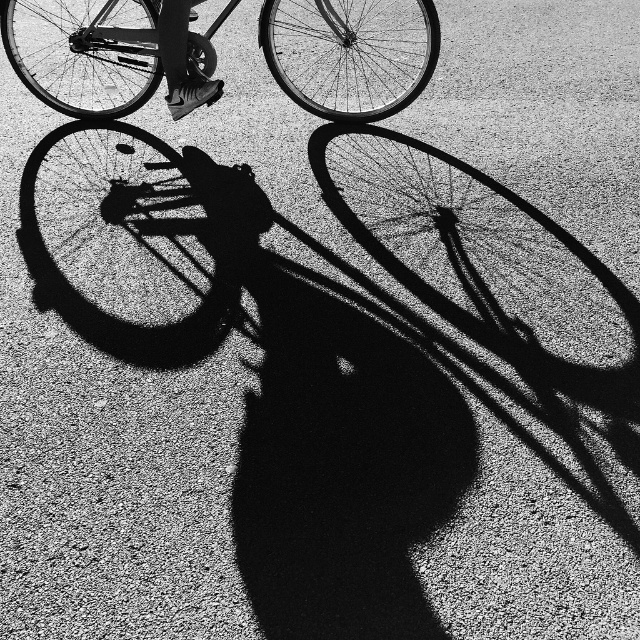
Is the position of metallic silver bicycle at upper center more distant than that of shiny black shoe at upper center?

Yes, it is behind shiny black shoe at upper center.

Does metallic silver bicycle at upper center have a lesser width compared to shiny black shoe at upper center?

No.

Which is in front, point (403, 26) or point (177, 93)?

Point (177, 93) is in front.

At what (x,y) coordinates should I click in order to perform the action: click on metallic silver bicycle at upper center. Please return your answer as a coordinate pair (x, y). Looking at the image, I should click on (349, 52).